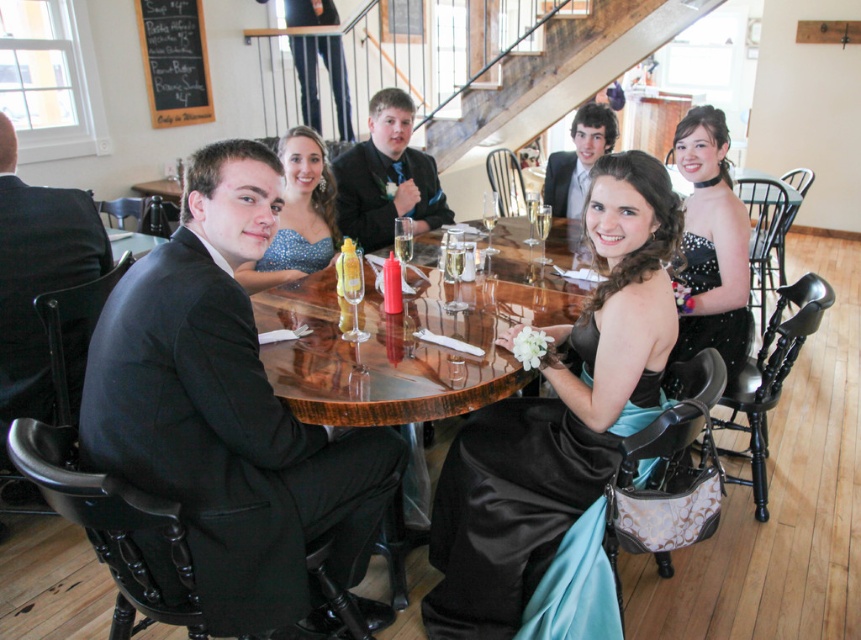
Is matte black suit at center above black chalkboard menu at upper left?

No, matte black suit at center is not above black chalkboard menu at upper left.

Between point (416, 234) and point (166, 35), which one is positioned in front?

Point (416, 234) is in front.

The width and height of the screenshot is (861, 640). Identify the location of matte black suit at center. (387, 177).

Does point (273, 548) lie behind point (165, 60)?

That is False.

How distant is matte black suit at left from black chalkboard menu at upper left?

matte black suit at left and black chalkboard menu at upper left are 12.32 feet apart.

Measure the distance between matte black suit at left and camera.

matte black suit at left is 4.68 feet from camera.

The width and height of the screenshot is (861, 640). In order to click on matte black suit at left in this screenshot , I will do `click(228, 412)`.

Is matte black suit at left bigger than satin black suit at upper center?

Yes.

Locate an element on the screen. The height and width of the screenshot is (640, 861). matte black suit at left is located at coordinates (228, 412).

Identify the location of matte black suit at left. (228, 412).